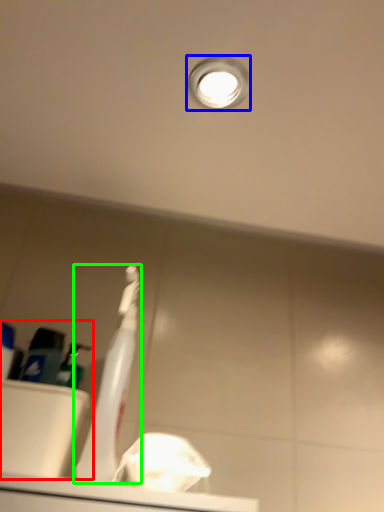
Question: Considering the real-world distances, which object is closest to sink (highlighted by a red box)? droplight (highlighted by a blue box) or toothbrush (highlighted by a green box).

Choices:
 (A) droplight
 (B) toothbrush

Answer: (B)